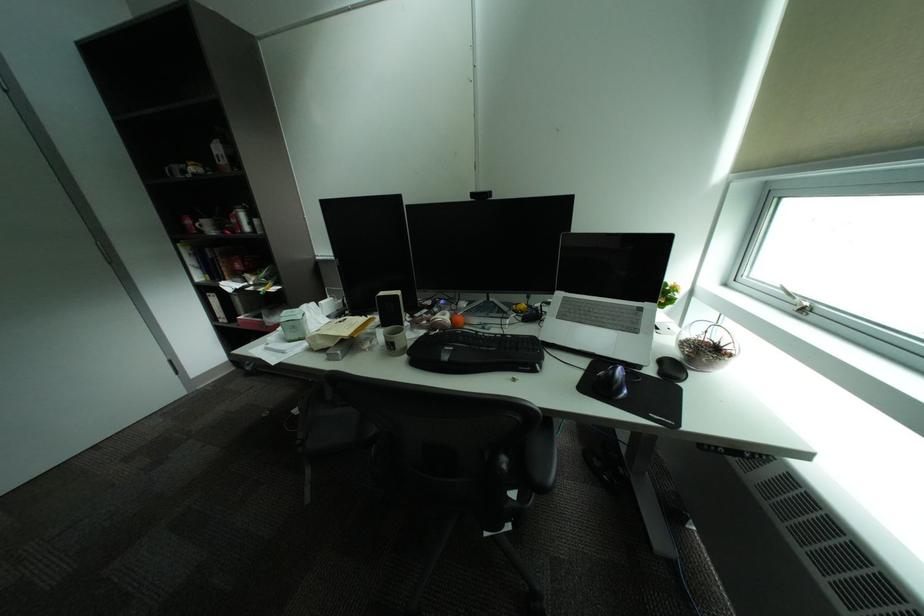
Image resolution: width=924 pixels, height=616 pixels. In order to click on metal window handle in this screenshot , I will do `click(796, 302)`.